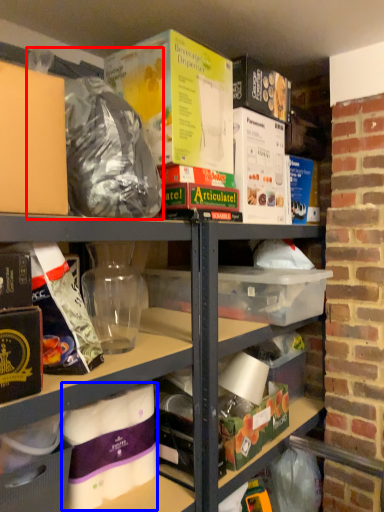
Question: Which object is closer to the camera taking this photo, garbage (highlighted by a red box) or yoghurt (highlighted by a blue box)?

Choices:
 (A) garbage
 (B) yoghurt

Answer: (A)